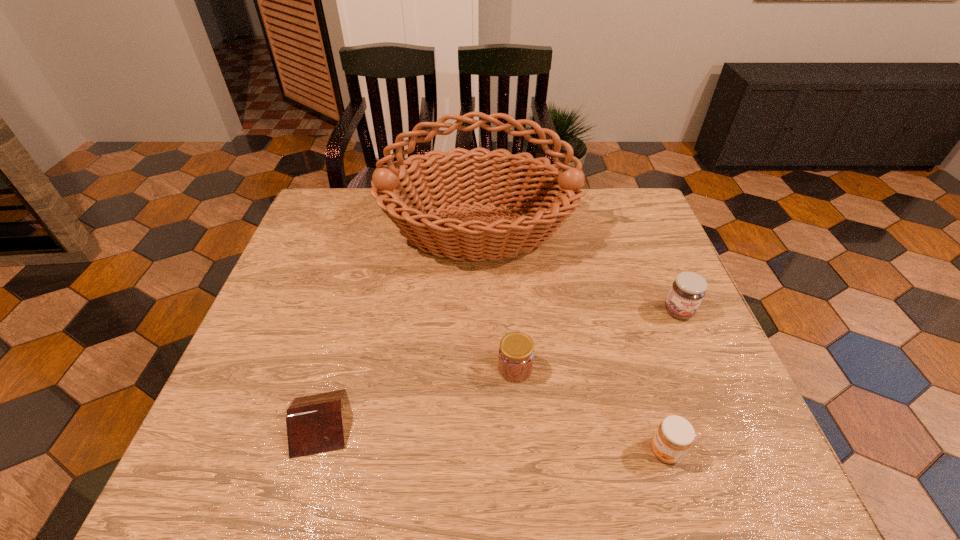
You are a GUI agent. You are given a task and a screenshot of the screen. Output one action in this format:
    pyautogui.click(x=<x>, y=<y>)
    Task: Click on the vacant area that lies between the fourth object from left to right and the second nearest jam
    The height and width of the screenshot is (540, 960).
    Given the screenshot: What is the action you would take?
    click(590, 410)

Locate an element on the screen. vacant area that lies between the rightmost jam and the basket is located at coordinates (578, 272).

At what (x,y) coordinates should I click in order to perform the action: click on free space between the third nearest object and the tallest object. Please return your answer as a coordinate pair (x, y). This screenshot has width=960, height=540. Looking at the image, I should click on (496, 300).

Image resolution: width=960 pixels, height=540 pixels. Find the location of `free spot between the basket and the nearest jam`. free spot between the basket and the nearest jam is located at coordinates (571, 341).

In order to click on free area in between the second jam from right to left and the fourth shortest object in this screenshot , I will do 672,381.

Locate an element on the screen. Image resolution: width=960 pixels, height=540 pixels. blank region between the nearest jam and the farthest object is located at coordinates (571, 341).

Find the location of `vacant area that lies between the nearest jam and the basket`. vacant area that lies between the nearest jam and the basket is located at coordinates (571, 341).

Identify which object is the third closest to the book. Please provide its 2D coordinates. Your answer should be formatted as a tuple, i.e. [(x, y)], where the tuple contains the x and y coordinates of a point satisfying the conditions above.

[(674, 436)]

The width and height of the screenshot is (960, 540). Find the location of `object that can be found as the third closest to the book`. object that can be found as the third closest to the book is located at coordinates (674, 436).

You are a GUI agent. You are given a task and a screenshot of the screen. Output one action in this format:
    pyautogui.click(x=<x>, y=<y>)
    Task: Click on the jam object that ranks as the third closest to the tallest object
    Image resolution: width=960 pixels, height=540 pixels.
    Given the screenshot: What is the action you would take?
    pos(674,436)